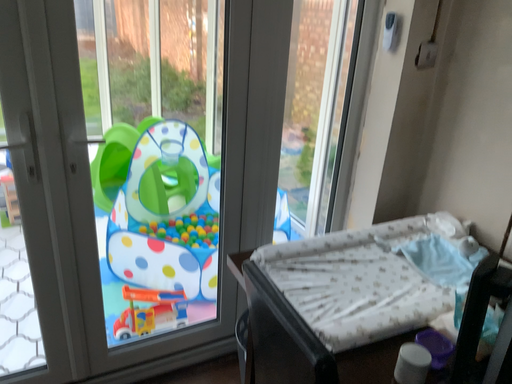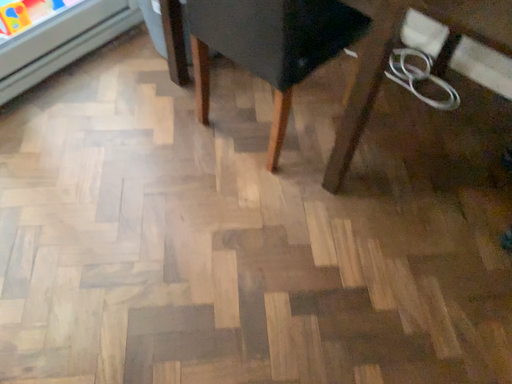
Question: Which way did the camera rotate in the video?

Choices:
 (A) rotated upward
 (B) rotated downward

Answer: (B)